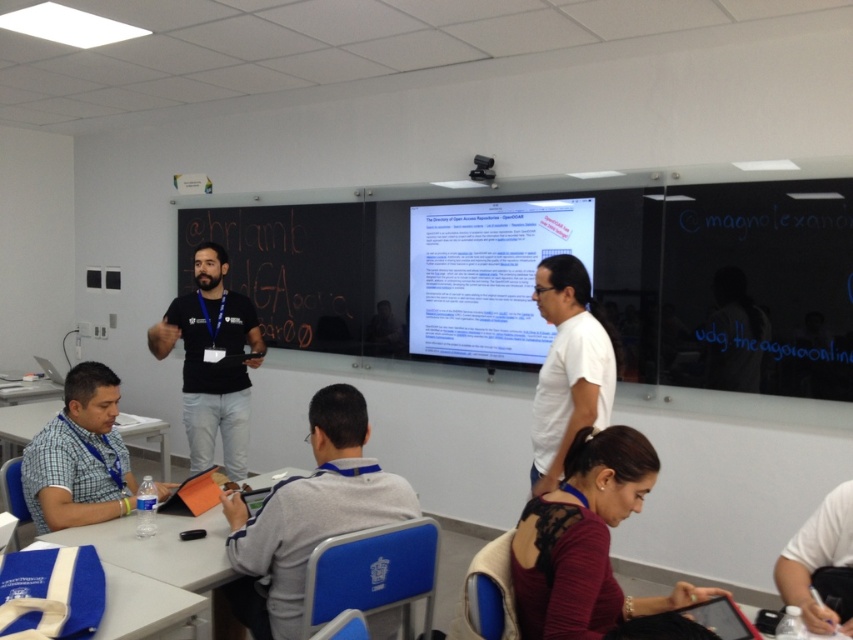
You are a student in the classroom and need to place a 30 cm long notebook on the white plastic table at center. Can the notebook fit on the table if you move it from the checkered fabric shirt at lower left?

The checkered fabric shirt at lower left is 27.93 centimeters from the white plastic table at center. Since the distance between them is less than the notebook length, the notebook cannot be placed on the table without exceeding the available space.

You are standing at the back of the classroom and want to walk to the front. There are two points marked in the room. Which point should you aim for first to reach the front faster? The two points are point (57, 486) and point (161, 525).

Point (57, 486) is in front of point (161, 525), so you should aim for point (57, 486) first to reach the front faster.

You are a student entering the classroom and see the blue fabric bag at lower left and the white plastic table at lower left. Which object is positioned more to the left side of the classroom?

The white plastic table at lower left is positioned more to the left side of the classroom because the blue fabric bag at lower left is to its right.